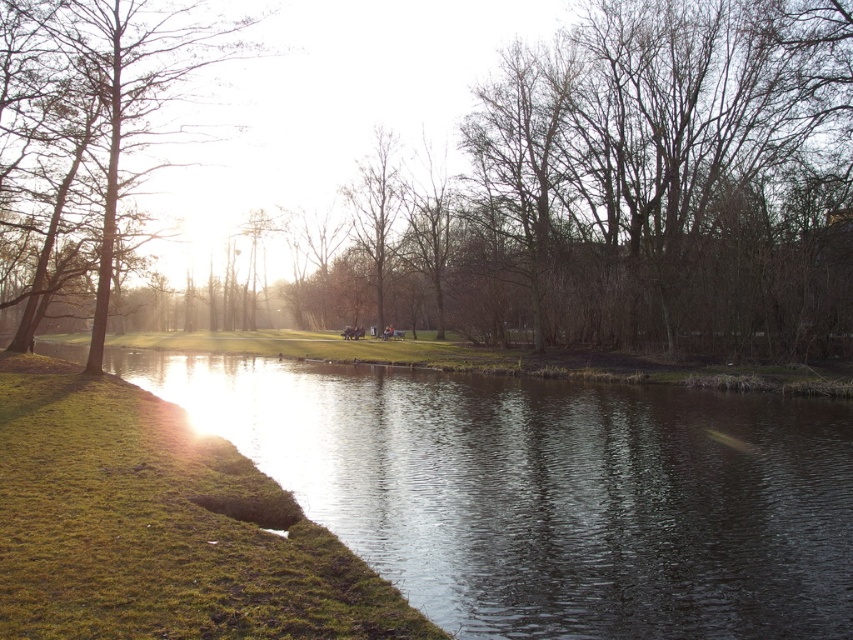
Looking at this image, you are standing at the center of the park and see a point marked at coordinates point (621, 192). What object is located at that point?

The point (621, 192) marks a brown leafless tree at left.

You are a park visitor trying to decide between two paths. One path leads to the brown leafless tree at left, and the other to the brown textured tree at upper left. If you want to walk under a wider tree canopy, which path should you choose?

The brown leafless tree at left has a wider width than the brown textured tree at upper left, so you should choose the path leading to the brown leafless tree at left for a wider canopy.